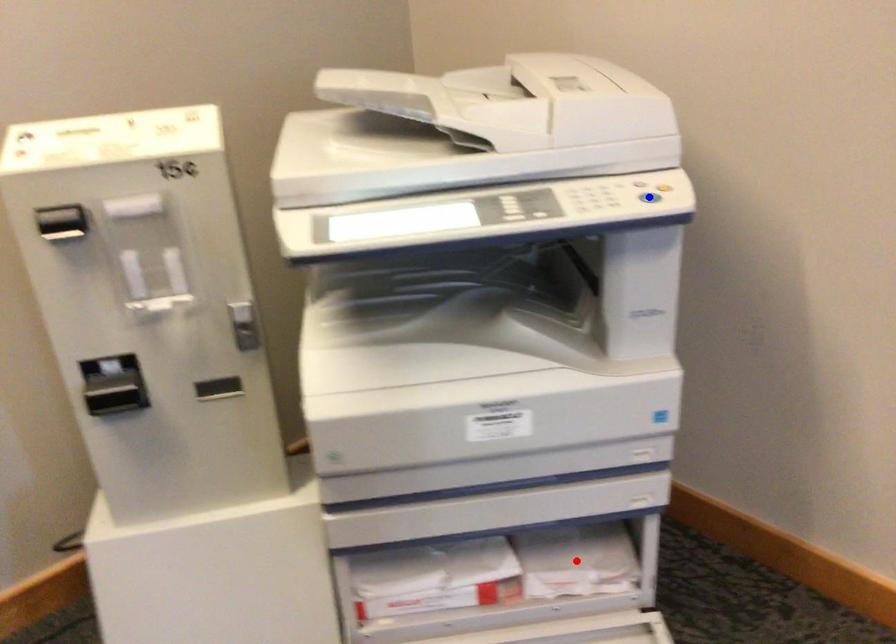
Question: Which of the two points in the image is closer to the camera?

Choices:
 (A) Blue point is closer.
 (B) Red point is closer.

Answer: (A)